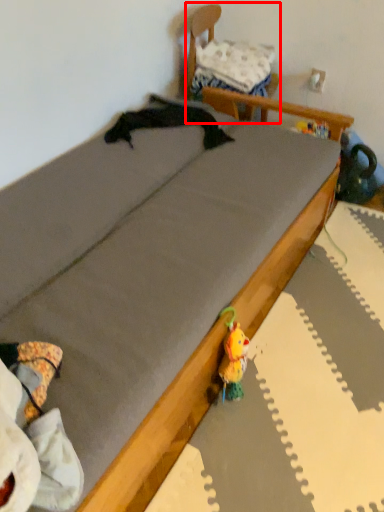
Question: Where is furniture (annotated by the red box) located in relation to pillow in the image?

Choices:
 (A) left
 (B) right

Answer: (B)